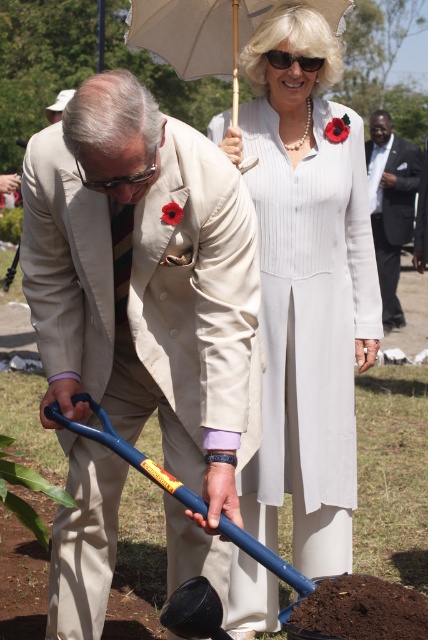
Question: Can you confirm if white fabric umbrella at upper center is positioned to the right of matte black goggles at left?

Choices:
 (A) no
 (B) yes

Answer: (B)

Question: Which of the following is the closest to the observer?

Choices:
 (A) matte beige suit at center
 (B) blue plastic shovel at lower center

Answer: (A)

Question: Is white pleated dress at upper center wider than blue plastic shovel at lower center?

Choices:
 (A) yes
 (B) no

Answer: (B)

Question: Which point is farther from the camera taking this photo?

Choices:
 (A) (353, 230)
 (B) (175, 8)

Answer: (B)

Question: Among these objects, which one is nearest to the camera?

Choices:
 (A) blue plastic shovel at lower center
 (B) white pleated dress at upper center

Answer: (A)

Question: From the image, what is the correct spatial relationship of white pleated dress at upper center in relation to white fabric umbrella at upper center?

Choices:
 (A) below
 (B) above

Answer: (A)